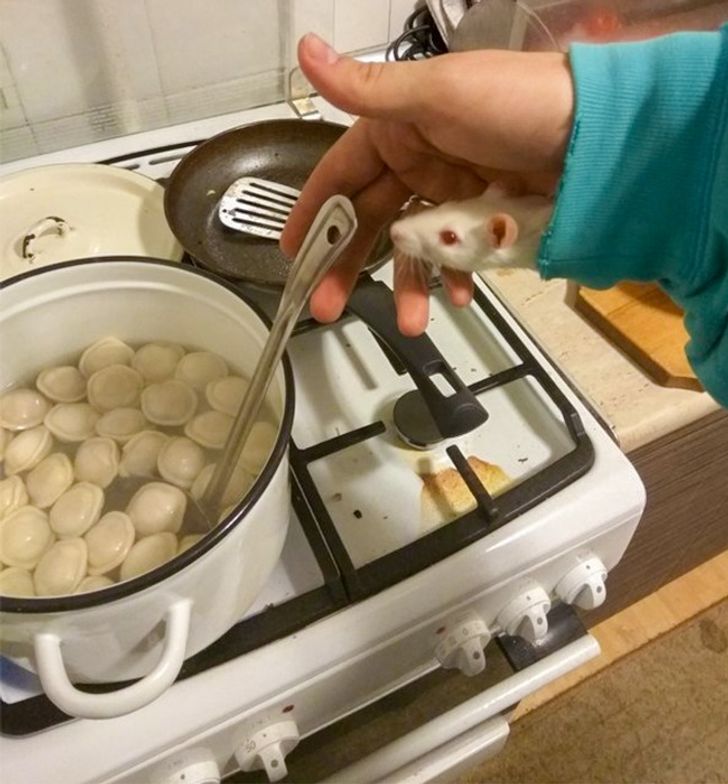
Where is `stove`? stove is located at coordinates (x=330, y=641).